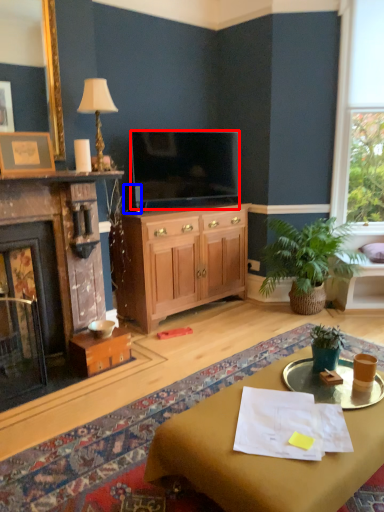
Question: Which of the following is the farthest to the observer, television (highlighted by a red box) or corded phone (highlighted by a blue box)?

Choices:
 (A) television
 (B) corded phone

Answer: (A)